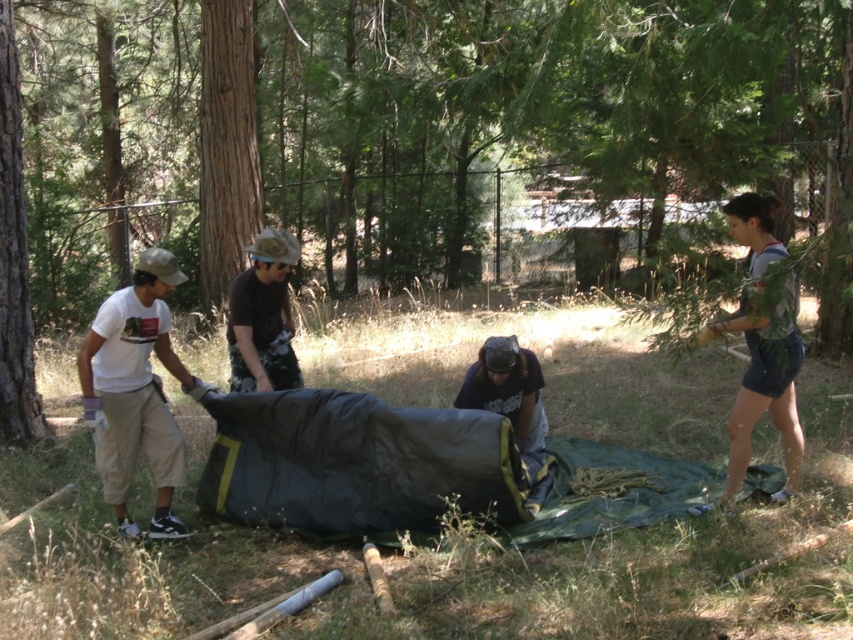
Question: Which of the following is the farthest from the observer?

Choices:
 (A) camouflage fabric shirt at center
 (B) gray cotton shorts at right
 (C) brown rough tree trunk at center-left

Answer: (C)

Question: Is camouflage fabric shirt at center to the left of dark blue fabric at center from the viewer's perspective?

Choices:
 (A) no
 (B) yes

Answer: (B)

Question: Which point is farther from the camera taking this photo?

Choices:
 (A) (279, 244)
 (B) (769, 371)
 (C) (4, 152)

Answer: (C)

Question: Can you confirm if brown rough tree trunk at center-left is positioned below dark blue fabric at center?

Choices:
 (A) no
 (B) yes

Answer: (A)

Question: Which object appears closest to the camera in this image?

Choices:
 (A) smooth brown bark at left
 (B) white cotton t-shirt at left
 (C) brown rough tree trunk at center-left
 (D) camouflage fabric shirt at center

Answer: (B)

Question: Observing the image, what is the correct spatial positioning of gray cotton shorts at right in reference to dark blue fabric at center?

Choices:
 (A) left
 (B) right

Answer: (B)